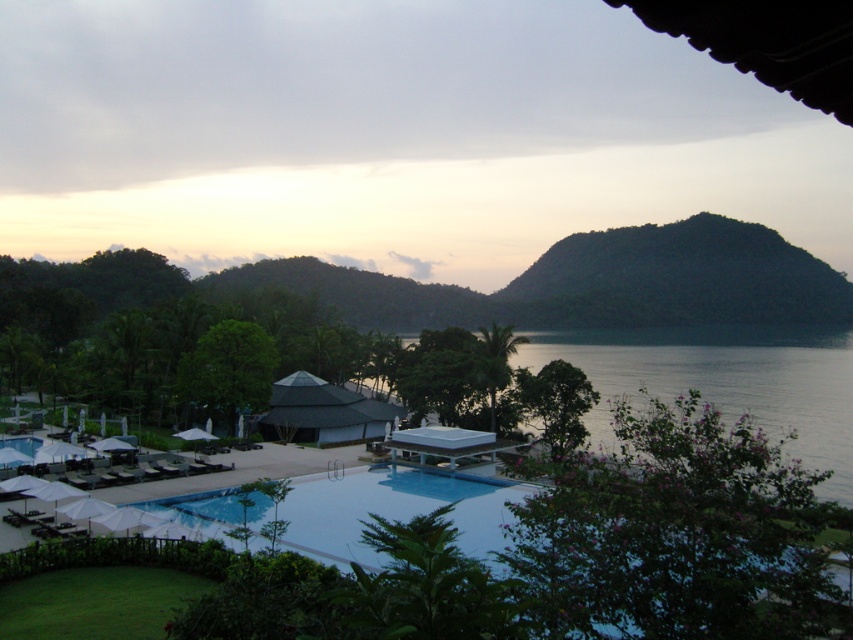
You are standing at the entrance of the resort and want to reach the transparent glass pool at center. Which direction should you walk to get there?

The transparent glass pool at center is located at point 0.794 on the x and 0.835 on the y coordinate. Since you are at the entrance, you should walk towards the center of the image to reach it.

You are standing at the resort and want to take a photo of two specific points in the scene. The first point is at coordinates point (689, 500) and the second point is at coordinates point (849, 458). Which point will appear larger in your photo?

Point (689, 500) will appear larger in the photo because it is closer to the viewer than point (849, 458).

You are a guest at the resort and want to take a photo of both the transparent glass pool at center and the transparent glass water at center. Which one should you focus on first if you want to capture both in one frame without moving the camera?

You should focus on the transparent glass pool at center first because it is smaller than the transparent glass water at center, so capturing it first ensures it remains in frame while the larger area of the transparent glass water at center will naturally fill the background.